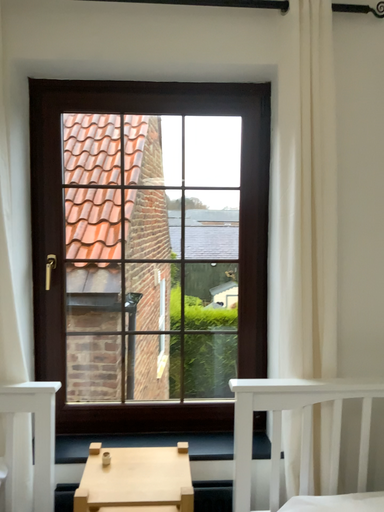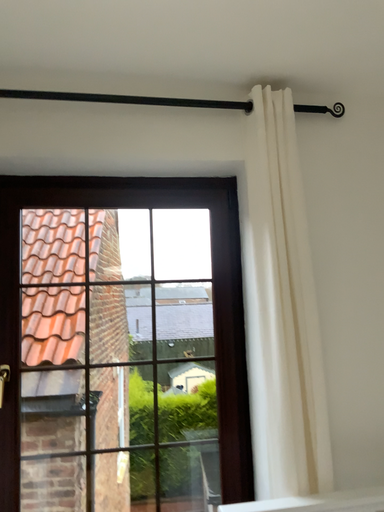
Question: How did the camera likely rotate when shooting the video?

Choices:
 (A) rotated upward
 (B) rotated downward

Answer: (A)